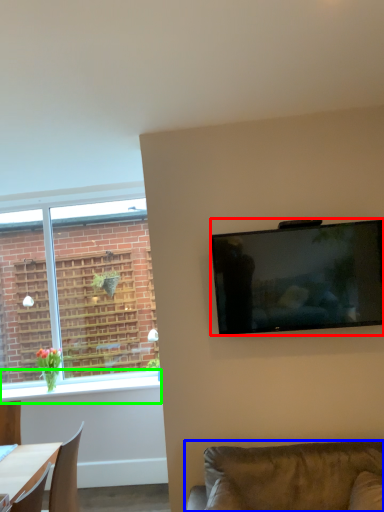
Question: Considering the real-world distances, which object is closest to television (highlighted by a red box)? studio couch (highlighted by a blue box) or window sill (highlighted by a green box).

Choices:
 (A) studio couch
 (B) window sill

Answer: (A)